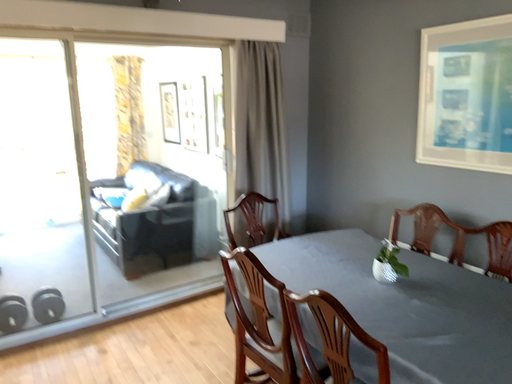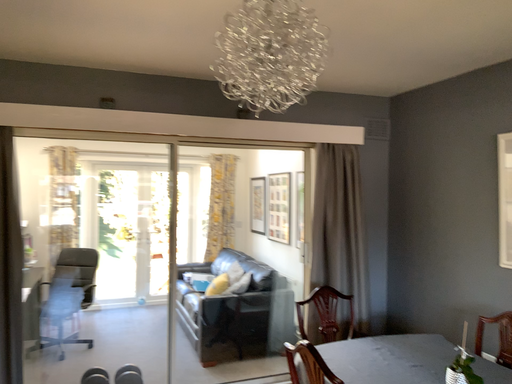
Question: How did the camera likely rotate when shooting the video?

Choices:
 (A) rotated left
 (B) rotated right

Answer: (A)